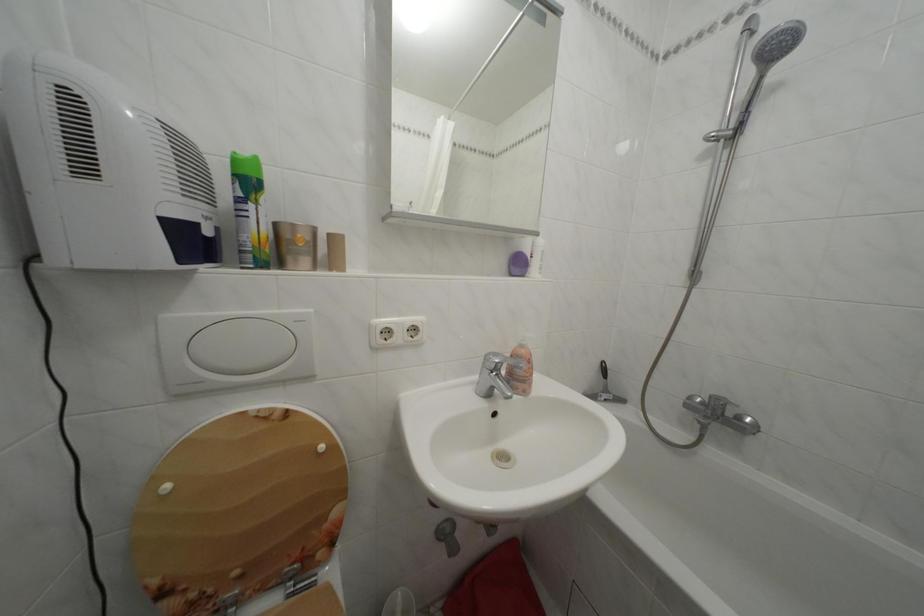
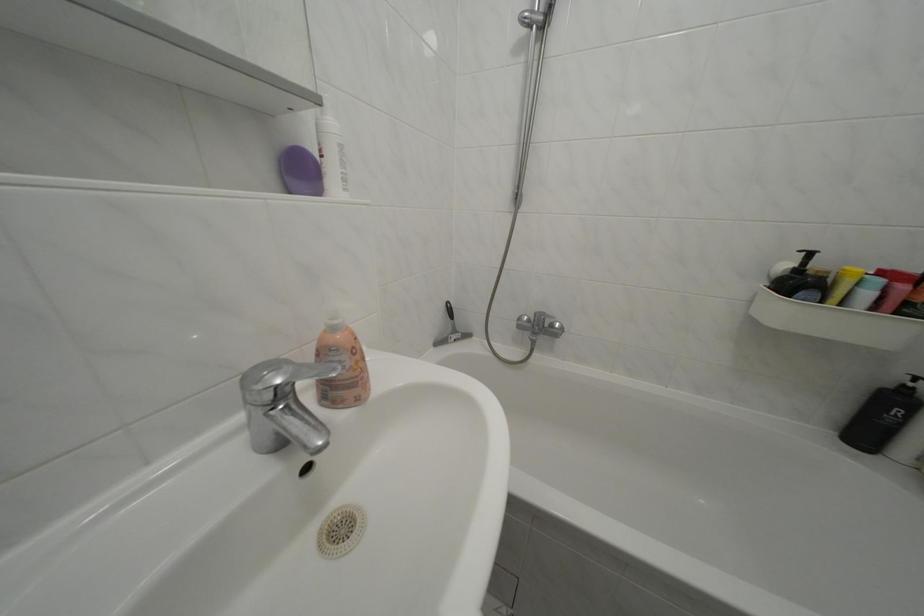
Locate, in the second image, the point that corresponds to [495,362] in the first image.

(252, 384)